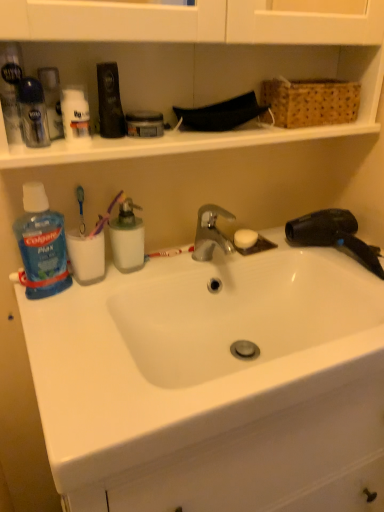
Identify the location of vacant area in front of blue plastic mouthwash at left, the second cleaning product viewed from the right. [x=59, y=333].